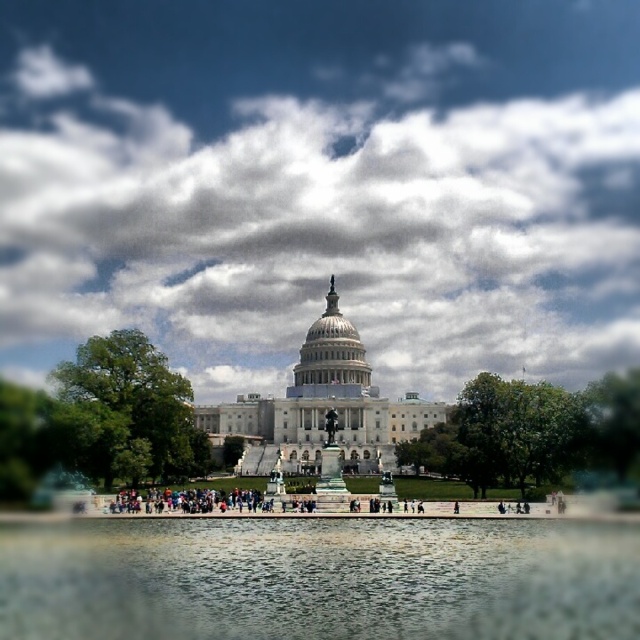
Is point (243, 388) positioned behind point (253, 609)?

Yes.

Is white fluffy cloud at center shorter than clear glass water at center?

In fact, white fluffy cloud at center may be taller than clear glass water at center.

Between point (348, 198) and point (236, 544), which one is positioned behind?

Point (348, 198)

I want to click on white fluffy cloud at center, so click(x=321, y=227).